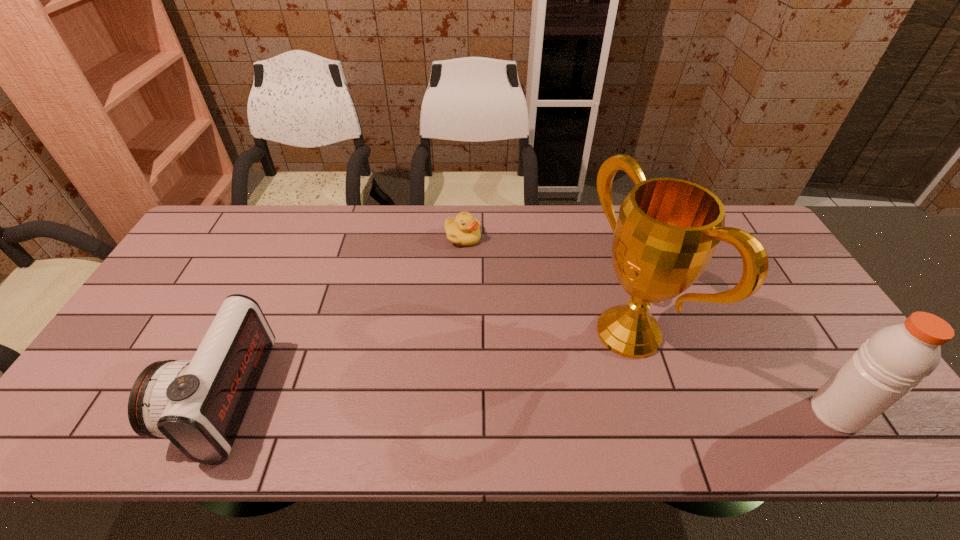
Locate an element on the screen. The image size is (960, 540). camcorder is located at coordinates (199, 405).

This screenshot has width=960, height=540. Identify the location of the leftmost object. (x=199, y=405).

The width and height of the screenshot is (960, 540). What are the coordinates of `the third shortest object` in the screenshot? It's located at coord(897,358).

Locate an element on the screen. The image size is (960, 540). shaker is located at coordinates (897, 358).

Locate an element on the screen. the third object from left to right is located at coordinates (667, 231).

Identify the location of award. This screenshot has height=540, width=960. (x=667, y=231).

The width and height of the screenshot is (960, 540). Identify the location of the second object from left to right. (464, 230).

You are a GUI agent. You are given a task and a screenshot of the screen. Output one action in this format:
    pyautogui.click(x=<x>, y=<y>)
    Task: Click on the duckling
    
    Given the screenshot: What is the action you would take?
    pyautogui.click(x=464, y=230)

Identify the location of vacant area situated 0.220m on the surface of the leftmost object. This screenshot has height=540, width=960. (97, 398).

Locate an element on the screen. vacant area situated on the surface of the leftmost object is located at coordinates (131, 398).